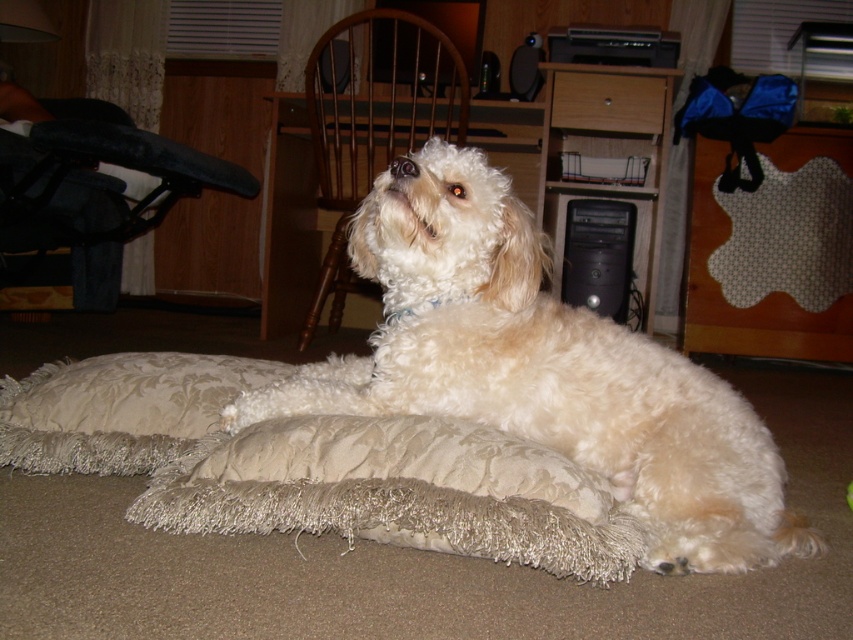
In order to click on white fluffy dog at center in this screenshot , I will do `click(543, 369)`.

Consider the image. Which is above, white fluffy dog at center or beige fabric dog bed at lower center?

Positioned higher is white fluffy dog at center.

Who is more forward, (648, 552) or (241, 376)?

Point (648, 552)

At what (x,y) coordinates should I click in order to perform the action: click on white fluffy dog at center. Please return your answer as a coordinate pair (x, y). The width and height of the screenshot is (853, 640). Looking at the image, I should click on (543, 369).

Is white fluffy dog at center shorter than beige shaggy pillow at lower center?

Incorrect, white fluffy dog at center's height does not fall short of beige shaggy pillow at lower center's.

Between point (805, 536) and point (189, 372), which one is positioned behind?

Point (189, 372)

Does point (563, 381) come farther from viewer compared to point (39, 470)?

No, it is in front of (39, 470).

You are a GUI agent. You are given a task and a screenshot of the screen. Output one action in this format:
    pyautogui.click(x=<x>, y=<y>)
    Task: Click on the white fluffy dog at center
    
    Given the screenshot: What is the action you would take?
    pyautogui.click(x=543, y=369)

Does point (190, 376) come in front of point (184, 433)?

No, (190, 376) is further to viewer.

Who is taller, beige fabric dog bed at lower center or beige shaggy pillow at lower center?

beige fabric dog bed at lower center is taller.

Where is `beige fabric dog bed at lower center`? The height and width of the screenshot is (640, 853). beige fabric dog bed at lower center is located at coordinates (309, 465).

Locate an element on the screen. Image resolution: width=853 pixels, height=640 pixels. beige fabric dog bed at lower center is located at coordinates (309, 465).